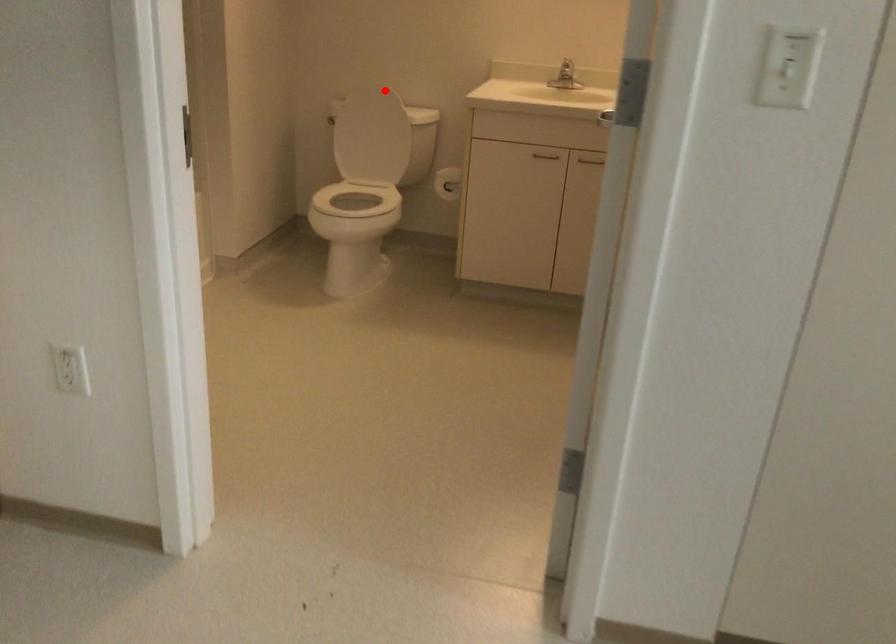
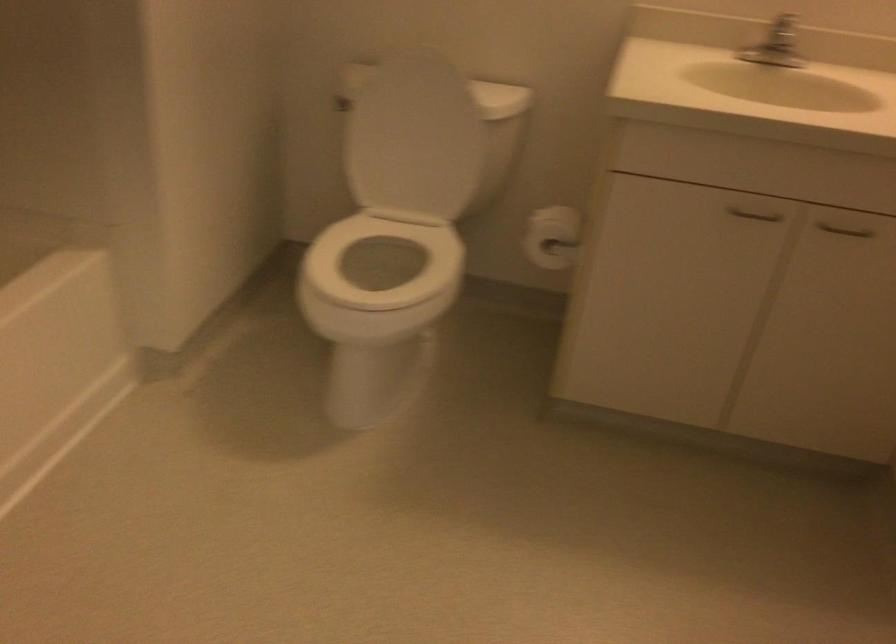
Question: I am providing you with two images of the same scene from different viewpoints. A red point is marked on the first image. Is the red point's position out of view in image 2?

Choices:
 (A) Yes
 (B) No

Answer: (B)